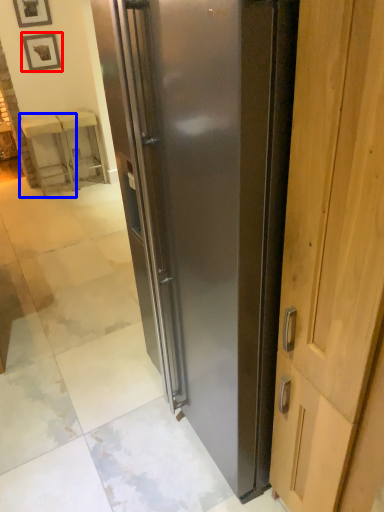
Question: Which point is further to the camera, picture frame (highlighted by a red box) or furniture (highlighted by a blue box)?

Choices:
 (A) picture frame
 (B) furniture

Answer: (B)